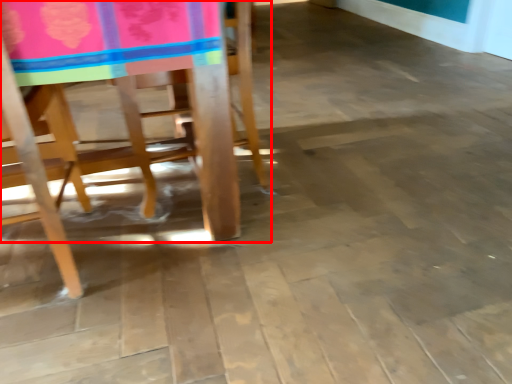
Question: From the image's perspective, what is the correct spatial positioning of chair (annotated by the red box) in reference to chair?

Choices:
 (A) above
 (B) below

Answer: (A)